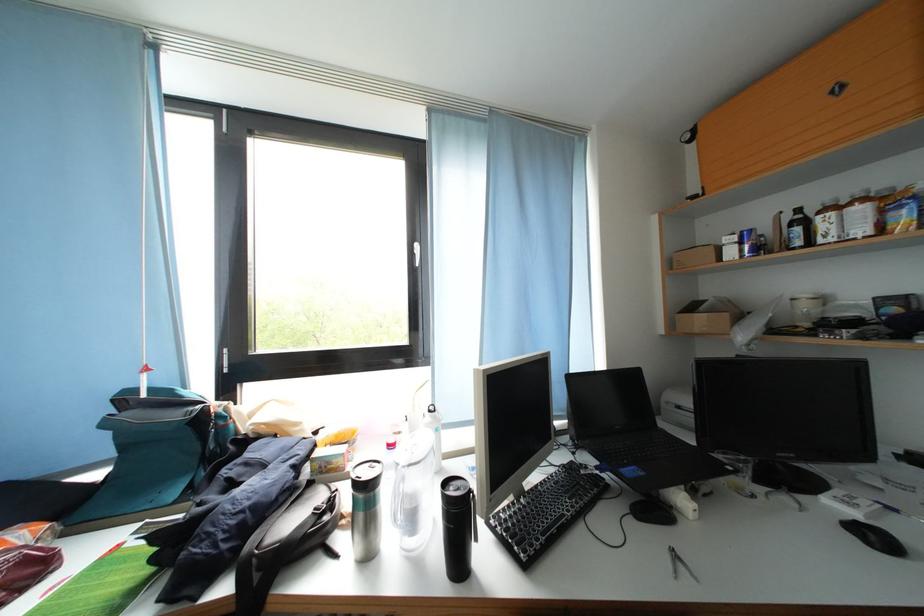
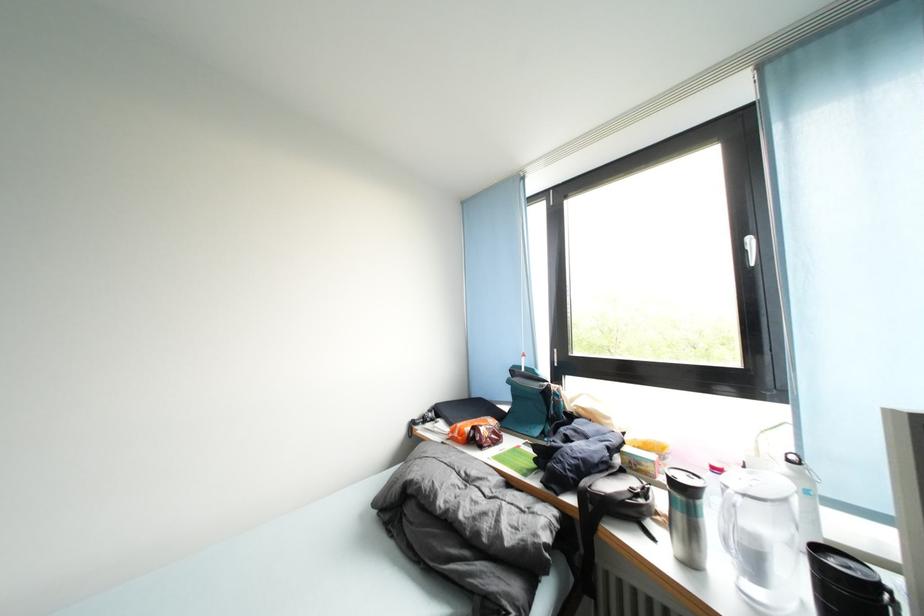
Where in the second image is the point corresponding to pixel 423 257 from the first image?

(757, 253)